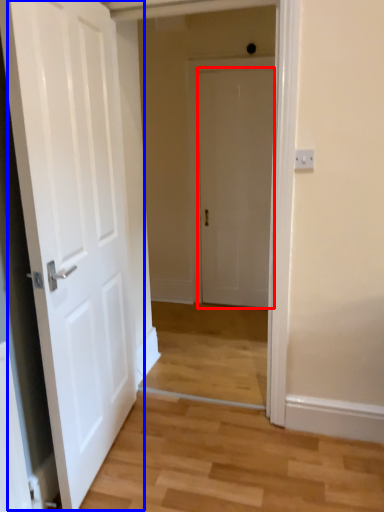
Question: Which object appears closest to the camera in this image, door (highlighted by a red box) or door (highlighted by a blue box)?

Choices:
 (A) door
 (B) door

Answer: (B)